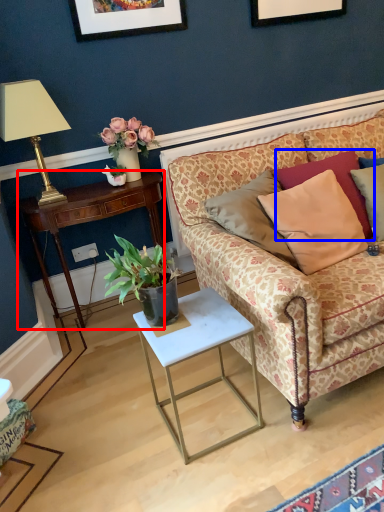
Question: Which point is further to the camera, desk (highlighted by a red box) or pillow (highlighted by a blue box)?

Choices:
 (A) desk
 (B) pillow

Answer: (A)